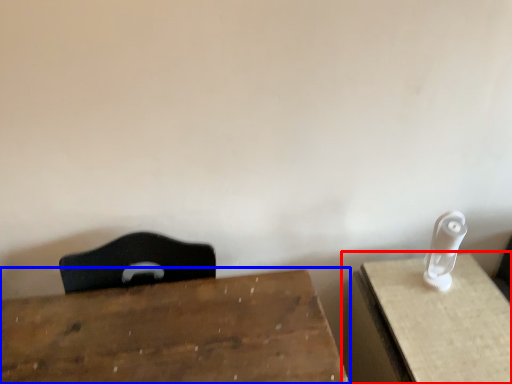
Question: Which object is closer to the camera taking this photo, table (highlighted by a red box) or table (highlighted by a blue box)?

Choices:
 (A) table
 (B) table

Answer: (B)